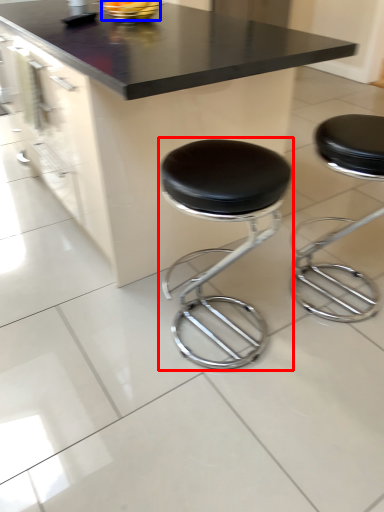
Question: Which of the following is the farthest to the observer, stool (highlighted by a red box) or food (highlighted by a blue box)?

Choices:
 (A) stool
 (B) food

Answer: (B)